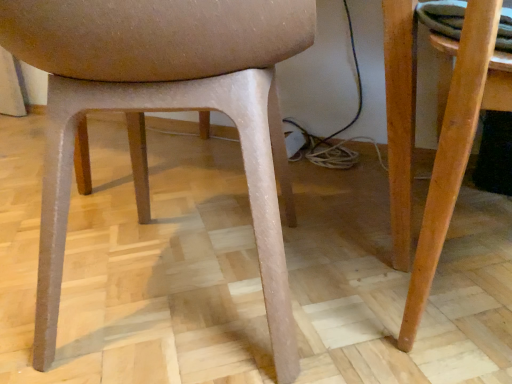
Question: Should I look upward or downward to see wooden table at right?

Choices:
 (A) down
 (B) up

Answer: (B)

Question: From a real-world perspective, does wooden table at right stand above matte plastic chair at center?

Choices:
 (A) no
 (B) yes

Answer: (A)

Question: Is wooden table at right facing away from matte plastic chair at center?

Choices:
 (A) yes
 (B) no

Answer: (B)

Question: Can you confirm if wooden table at right is taller than matte plastic chair at center?

Choices:
 (A) no
 (B) yes

Answer: (A)

Question: Considering the relative sizes of wooden table at right and matte plastic chair at center in the image provided, is wooden table at right smaller than matte plastic chair at center?

Choices:
 (A) yes
 (B) no

Answer: (A)

Question: Is wooden table at right bigger than matte plastic chair at center?

Choices:
 (A) yes
 (B) no

Answer: (B)

Question: Are wooden table at right and matte plastic chair at center beside each other?

Choices:
 (A) yes
 (B) no

Answer: (B)

Question: Can you confirm if matte plastic chair at center is wider than wooden table at right?

Choices:
 (A) yes
 (B) no

Answer: (A)

Question: Can you confirm if matte plastic chair at center is bigger than wooden table at right?

Choices:
 (A) yes
 (B) no

Answer: (A)

Question: From a real-world perspective, is matte plastic chair at center positioned over wooden table at right based on gravity?

Choices:
 (A) no
 (B) yes

Answer: (B)

Question: Considering the relative sizes of matte plastic chair at center and wooden table at right in the image provided, is matte plastic chair at center taller than wooden table at right?

Choices:
 (A) no
 (B) yes

Answer: (B)

Question: From the image's perspective, is matte plastic chair at center located above wooden table at right?

Choices:
 (A) yes
 (B) no

Answer: (A)

Question: Does matte plastic chair at center have a smaller size compared to wooden table at right?

Choices:
 (A) no
 (B) yes

Answer: (A)

Question: From the image's perspective, is wooden table at right located above or below matte plastic chair at center?

Choices:
 (A) below
 (B) above

Answer: (A)